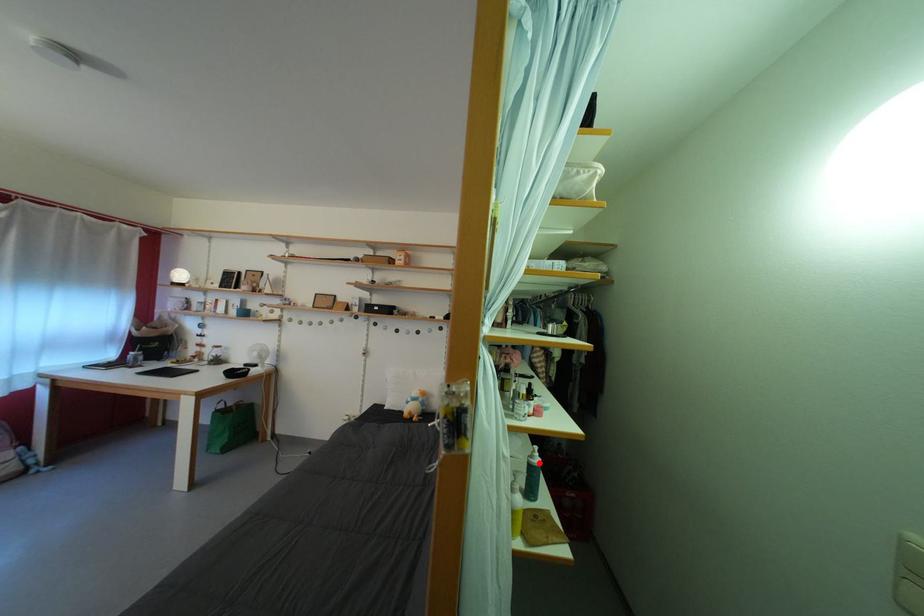
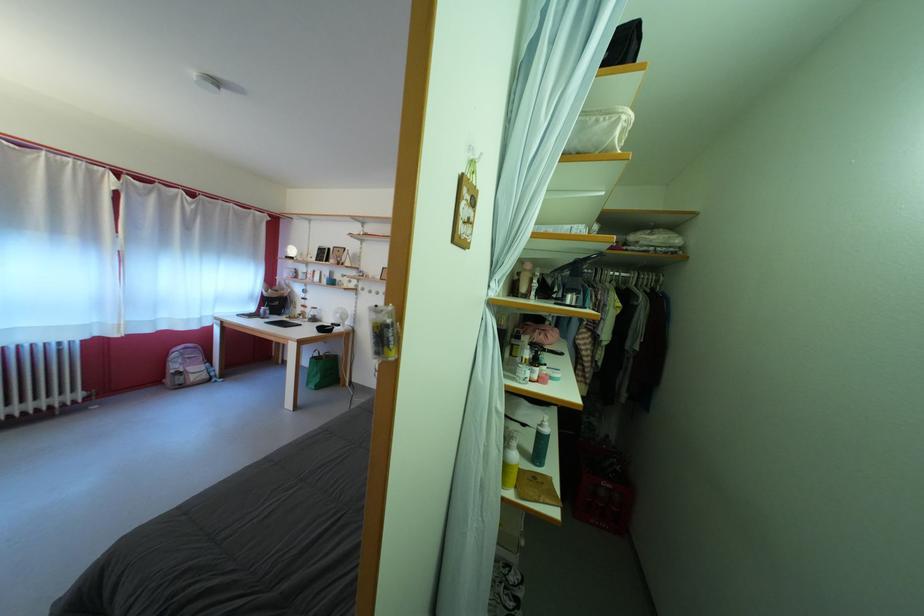
Where in the second image is the point corresponding to the highlighted location from the first image?

(549, 431)